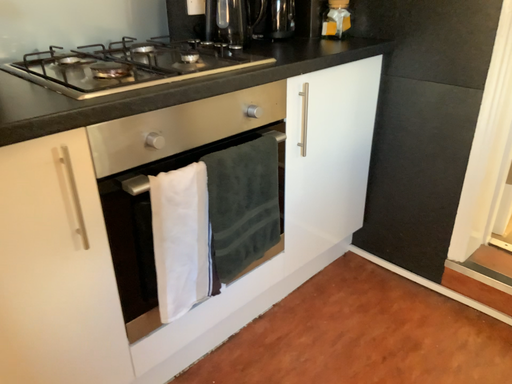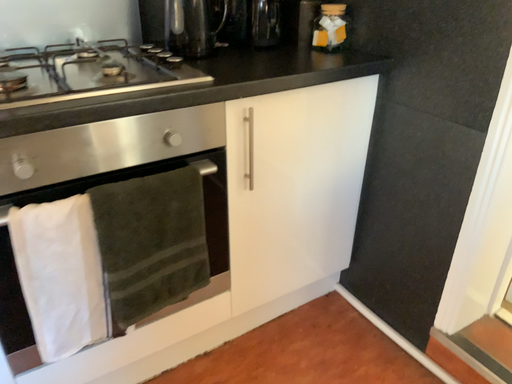
Question: How did the camera likely rotate when shooting the video?

Choices:
 (A) rotated right
 (B) rotated left

Answer: (B)